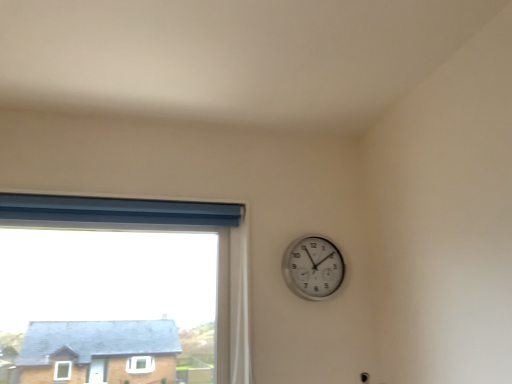
Question: From the image's perspective, relative to silver metallic wall clock at upper right, is blue fabric window at upper left above or below?

Choices:
 (A) below
 (B) above

Answer: (A)

Question: Considering the positions of blue fabric window at upper left and silver metallic wall clock at upper right in the image, is blue fabric window at upper left wider or thinner than silver metallic wall clock at upper right?

Choices:
 (A) wide
 (B) thin

Answer: (A)

Question: From a real-world perspective, relative to silver metallic wall clock at upper right, is blue fabric window at upper left vertically above or below?

Choices:
 (A) above
 (B) below

Answer: (B)

Question: From the image's perspective, is silver metallic wall clock at upper right above or below blue fabric window at upper left?

Choices:
 (A) below
 (B) above

Answer: (B)

Question: From a real-world perspective, relative to blue fabric window at upper left, is silver metallic wall clock at upper right vertically above or below?

Choices:
 (A) below
 (B) above

Answer: (B)

Question: Would you say silver metallic wall clock at upper right is inside or outside blue fabric window at upper left?

Choices:
 (A) inside
 (B) outside

Answer: (B)

Question: Does point (329, 291) appear closer or farther from the camera than point (237, 211)?

Choices:
 (A) farther
 (B) closer

Answer: (B)